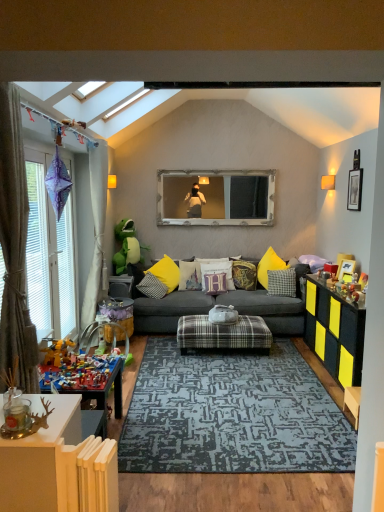
Question: Is dark gray fabric couch at center wider than white fabric curtain at left, the second curtain from the front?

Choices:
 (A) yes
 (B) no

Answer: (A)

Question: Does dark gray fabric couch at center have a smaller size compared to white fabric curtain at left, the second curtain from the front?

Choices:
 (A) yes
 (B) no

Answer: (B)

Question: Does dark gray fabric couch at center have a lesser width compared to white fabric curtain at left, positioned as the 1th curtain in back-to-front order?

Choices:
 (A) yes
 (B) no

Answer: (B)

Question: Does dark gray fabric couch at center turn towards white fabric curtain at left, positioned as the 1th curtain in back-to-front order?

Choices:
 (A) no
 (B) yes

Answer: (A)

Question: Is dark gray fabric couch at center further to the viewer compared to white fabric curtain at left, the second curtain from the front?

Choices:
 (A) no
 (B) yes

Answer: (B)

Question: Is white fabric curtain at left, positioned as the 1th curtain in back-to-front order, at the back of dark gray fabric couch at center?

Choices:
 (A) yes
 (B) no

Answer: (B)

Question: Is brown fabric curtain at left, which ranks as the 1th curtain in front-to-back order, outside plaid fabric ottoman at center, which ranks as the 2th table in left-to-right order?

Choices:
 (A) no
 (B) yes

Answer: (B)

Question: From the image's perspective, is brown fabric curtain at left, the second curtain in the back-to-front sequence, on plaid fabric ottoman at center, which is counted as the first table, starting from the right?

Choices:
 (A) yes
 (B) no

Answer: (A)

Question: Is brown fabric curtain at left, the second curtain in the back-to-front sequence, turned away from plaid fabric ottoman at center, which is counted as the first table, starting from the right?

Choices:
 (A) no
 (B) yes

Answer: (A)

Question: Is brown fabric curtain at left, which ranks as the 1th curtain in front-to-back order, positioned far away from plaid fabric ottoman at center, which ranks as the 2th table in left-to-right order?

Choices:
 (A) no
 (B) yes

Answer: (B)

Question: Can you confirm if brown fabric curtain at left, the second curtain in the back-to-front sequence, is smaller than plaid fabric ottoman at center, which ranks as the 2th table in left-to-right order?

Choices:
 (A) yes
 (B) no

Answer: (A)

Question: From the image's perspective, would you say brown fabric curtain at left, the second curtain in the back-to-front sequence, is shown under plaid fabric ottoman at center, which is counted as the first table, starting from the right?

Choices:
 (A) no
 (B) yes

Answer: (A)

Question: Is plush yellow pillow at center, the 3th pillow from the left, located outside dark gray fabric couch at center?

Choices:
 (A) yes
 (B) no

Answer: (B)